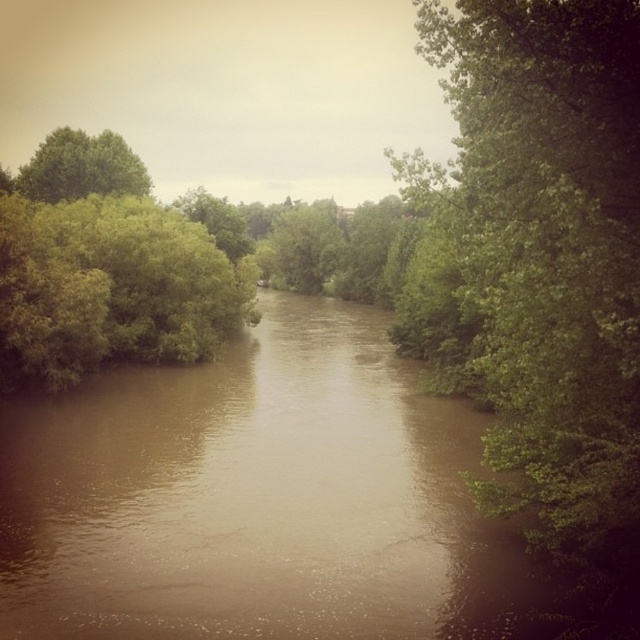
Question: Is green leafy tree at right to the left of green leafy tree at upper left from the viewer's perspective?

Choices:
 (A) no
 (B) yes

Answer: (A)

Question: Is green leafy tree at right below green leafy tree at upper left?

Choices:
 (A) no
 (B) yes

Answer: (B)

Question: Which of these objects is positioned closest to the green leafy tree at center?

Choices:
 (A) green leafy tree at right
 (B) green leafy tree at upper left

Answer: (B)

Question: Which of the following is the closest to the observer?

Choices:
 (A) (19, 184)
 (B) (577, 275)

Answer: (B)

Question: Is green leafy tree at upper left below green leafy tree at center?

Choices:
 (A) no
 (B) yes

Answer: (B)

Question: Estimate the real-world distances between objects in this image. Which object is farther from the green leafy tree at upper left?

Choices:
 (A) green leafy tree at center
 (B) green leafy tree at right

Answer: (A)